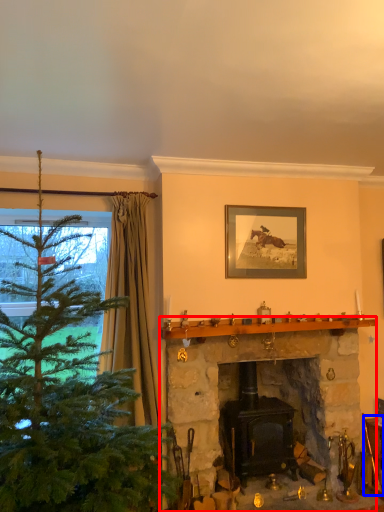
Question: Which object is closer to the camera taking this photo, fireplace (highlighted by a red box) or furniture (highlighted by a blue box)?

Choices:
 (A) fireplace
 (B) furniture

Answer: (A)